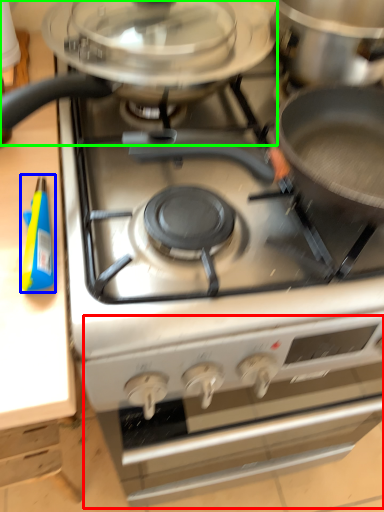
Question: Estimate the real-world distances between objects in this image. Which object is farther from oven (highlighted by a red box), appliance (highlighted by a blue box) or kitchen appliance (highlighted by a green box)?

Choices:
 (A) appliance
 (B) kitchen appliance

Answer: (A)